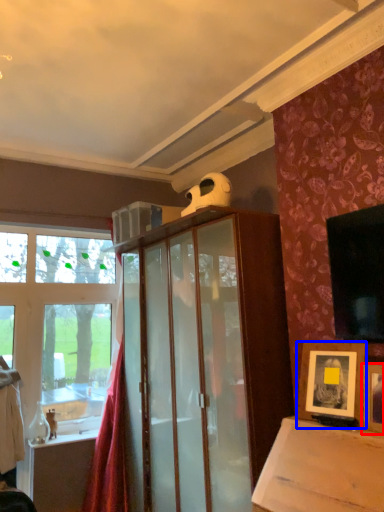
Question: Which of the following is the closest to the observer, picture frame (highlighted by a red box) or picture frame (highlighted by a blue box)?

Choices:
 (A) picture frame
 (B) picture frame

Answer: (A)